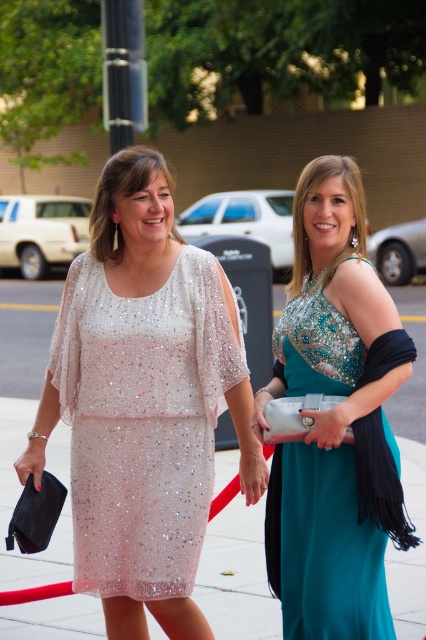
Which is behind, point (301, 332) or point (71, 266)?

The point (71, 266) is behind.

Does teal sequined dress at center have a lesser height compared to sequined fabric dress at left?

Incorrect, teal sequined dress at center's height does not fall short of sequined fabric dress at left's.

I want to click on teal sequined dress at center, so [x=334, y=420].

Does teal sequined dress at center appear on the left side of pearl sequined dress at center?

Yes, teal sequined dress at center is to the left of pearl sequined dress at center.

Does teal sequined dress at center have a smaller size compared to pearl sequined dress at center?

Indeed, teal sequined dress at center has a smaller size compared to pearl sequined dress at center.

Find the location of `teal sequined dress at center`. teal sequined dress at center is located at coordinates (334, 420).

Who is more forward, (138, 538) or (236, 556)?

Positioned in front is point (138, 538).

Can you confirm if sequined fabric dress at left is positioned to the left of pearl sequined dress at center?

Indeed, sequined fabric dress at left is positioned on the left side of pearl sequined dress at center.

Is point (75, 458) closer to viewer compared to point (262, 545)?

Yes, it is in front of point (262, 545).

The width and height of the screenshot is (426, 640). I want to click on sequined fabric dress at left, so click(x=143, y=420).